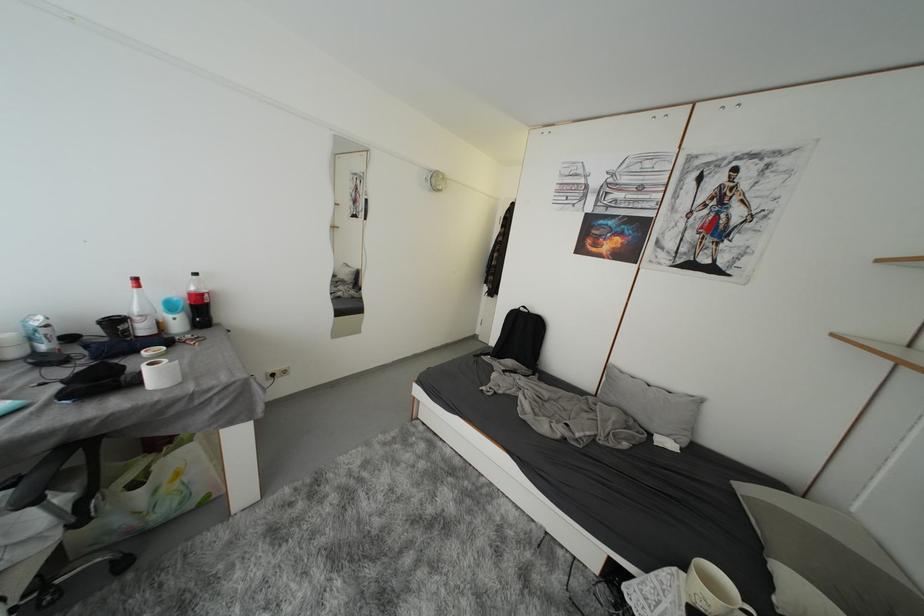
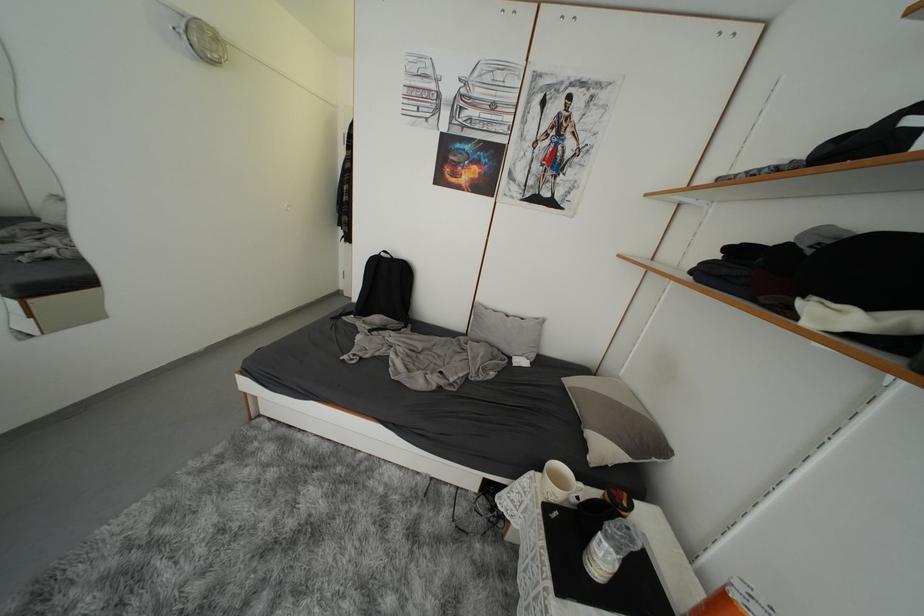
The point at (x=658, y=386) is marked in the first image. Where is the corresponding point in the second image?

(516, 315)